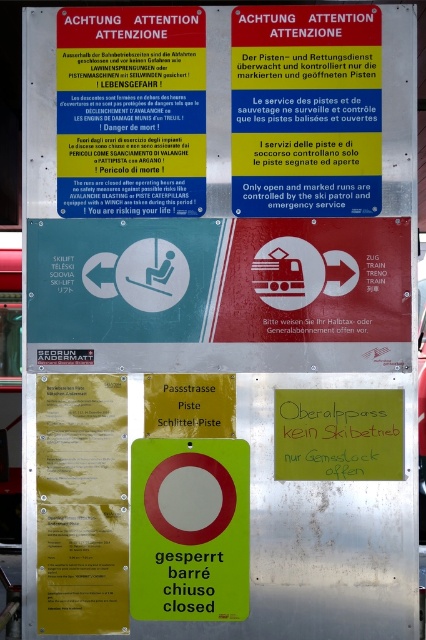
Does point (172, 182) lie in front of point (232, 609)?

No, (172, 182) is further to viewer.

Who is positioned more to the right, red plastic sign at upper center or green matte sign at center?

green matte sign at center is more to the right.

Does point (204, 141) come behind point (175, 472)?

That is True.

The width and height of the screenshot is (426, 640). In order to click on red plastic sign at upper center in this screenshot , I will do `click(131, 112)`.

Describe the element at coordinates (131, 112) in the screenshot. I see `red plastic sign at upper center` at that location.

Can you confirm if red plastic sign at upper center is shorter than green paper sign at center?

No.

Between point (57, 64) and point (379, 396), which one is positioned behind?

The point (57, 64) is behind.

Where is `red plastic sign at upper center`? This screenshot has width=426, height=640. red plastic sign at upper center is located at coordinates (131, 112).

Which is above, green matte sign at center or green paper sign at center?

green paper sign at center is above.

Find the location of a particular element. This screenshot has height=640, width=426. green matte sign at center is located at coordinates (189, 529).

Where is `green matte sign at center`? This screenshot has height=640, width=426. green matte sign at center is located at coordinates (189, 529).